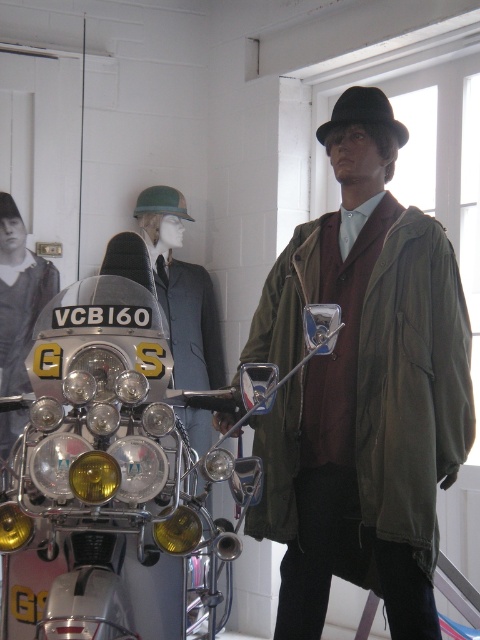
Question: Which object is the farthest from the shiny chrome motorcycle at center?

Choices:
 (A) olive green fabric jacket at center
 (B) matte black jacket at center
 (C) black felt fedora at upper center

Answer: (B)

Question: Observing the image, what is the correct spatial positioning of shiny chrome motorcycle at center in reference to black felt fedora at upper center?

Choices:
 (A) right
 (B) left

Answer: (B)

Question: Is shiny chrome motorcycle at center further to camera compared to matte black jacket at center?

Choices:
 (A) yes
 (B) no

Answer: (B)

Question: Can you confirm if shiny chrome motorcycle at center is wider than olive green fabric jacket at center?

Choices:
 (A) no
 (B) yes

Answer: (B)

Question: Which point is farther to the camera?

Choices:
 (A) (404, 125)
 (B) (358, 344)
 (C) (33, 292)
 (D) (170, 362)

Answer: (C)

Question: Which of the following is the closest to the observer?

Choices:
 (A) (95, 451)
 (B) (46, 292)

Answer: (A)